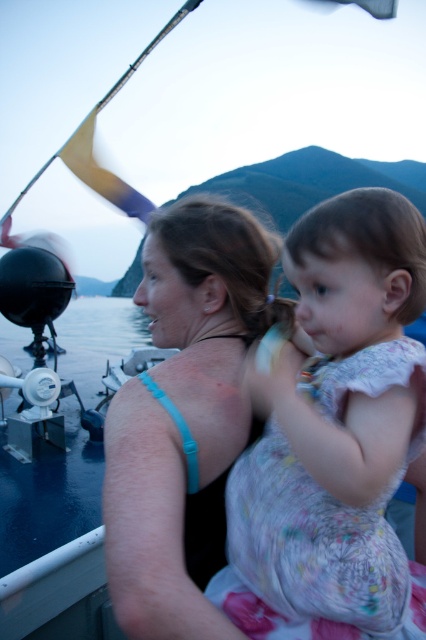
Can you confirm if floral dress at center is shorter than blue fabric top at center?

Indeed, floral dress at center has a lesser height compared to blue fabric top at center.

Is floral dress at center thinner than blue fabric top at center?

In fact, floral dress at center might be wider than blue fabric top at center.

Locate an element on the screen. floral dress at center is located at coordinates coord(333,435).